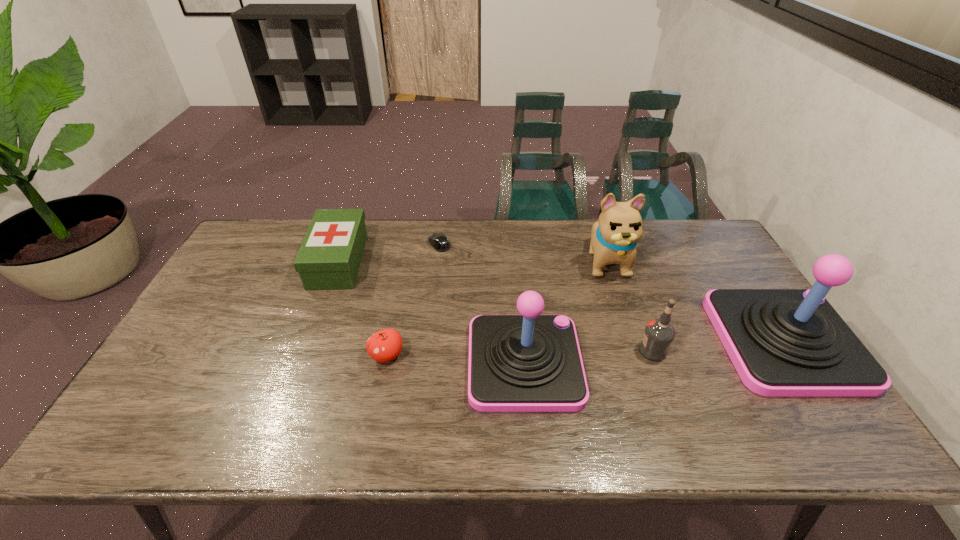
Where is `the first-aid kit present at the far edge`? the first-aid kit present at the far edge is located at coordinates (329, 257).

Locate an element on the screen. The image size is (960, 540). mouse situated at the far edge is located at coordinates (439, 241).

Where is `puppy located in the far edge section of the desktop`? puppy located in the far edge section of the desktop is located at coordinates (614, 237).

At what (x,y) coordinates should I click in order to perform the action: click on object located at the right edge. Please return your answer as a coordinate pair (x, y). Looking at the image, I should click on (782, 342).

The image size is (960, 540). Find the location of `object present at the near right corner`. object present at the near right corner is located at coordinates (782, 342).

Identify the location of free location at the far edge. (571, 240).

In the image, there is a desktop. At what (x,y) coordinates should I click in order to perform the action: click on vacant space at the near edge. Please return your answer as a coordinate pair (x, y). Looking at the image, I should click on (665, 399).

Where is `vacant region at the right edge of the desktop`? vacant region at the right edge of the desktop is located at coordinates (726, 278).

At what (x,y) coordinates should I click in order to perform the action: click on free space at the far left corner. Please return your answer as a coordinate pair (x, y). Looking at the image, I should click on (250, 246).

The height and width of the screenshot is (540, 960). In the image, there is a desktop. In order to click on blank space at the near left corner in this screenshot , I will do `click(154, 384)`.